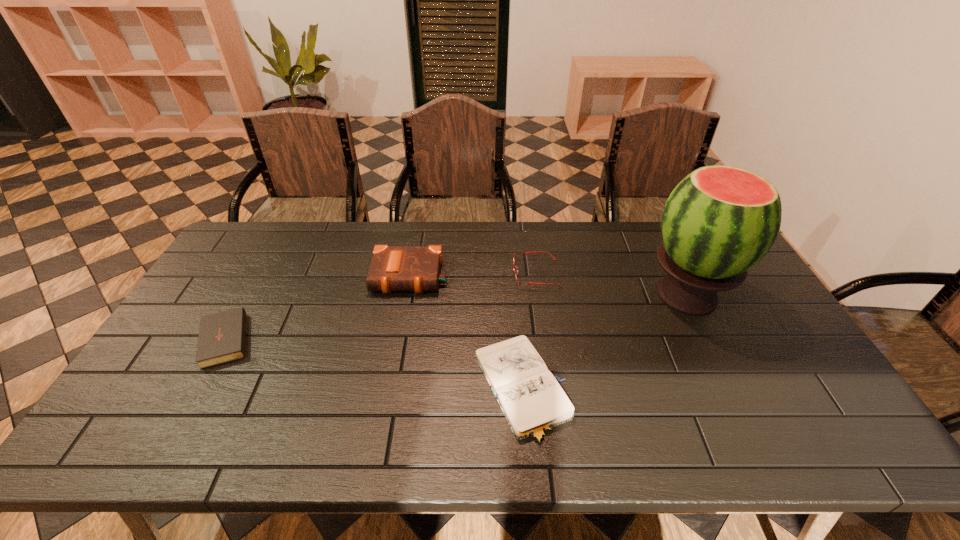
I want to click on vacant point located between the left Bible and the tallest object, so click(457, 315).

Identify the location of free area in between the spectacles and the shorter Bible. (382, 305).

Locate an element on the screen. This screenshot has width=960, height=540. vacant space that is in between the fourth object from right to left and the spectacles is located at coordinates (473, 275).

You are a GUI agent. You are given a task and a screenshot of the screen. Output one action in this format:
    pyautogui.click(x=<x>, y=<y>)
    Task: Click on the empty location between the rightmost object and the left Bible
    The width and height of the screenshot is (960, 540).
    Given the screenshot: What is the action you would take?
    pyautogui.click(x=457, y=315)

Find the location of a particular element. This screenshot has height=540, width=960. object that is the second nearest to the spectacles is located at coordinates (393, 268).

The width and height of the screenshot is (960, 540). I want to click on object that is the second closest to the right Bible, so click(521, 253).

The image size is (960, 540). I want to click on vacant position in the image that satisfies the following two spatial constraints: 1. on the spine side of the farther Bible; 2. on the left side of the rightmost object, so click(407, 295).

I want to click on free spot that satisfies the following two spatial constraints: 1. on the lenses of the spectacles; 2. on the right side of the watermelon, so click(539, 295).

Where is `vacant space that satisfies the following two spatial constraints: 1. on the back side of the tallest object; 2. on the lenses of the spectacles`? The height and width of the screenshot is (540, 960). vacant space that satisfies the following two spatial constraints: 1. on the back side of the tallest object; 2. on the lenses of the spectacles is located at coordinates (676, 273).

Identify the location of vacant region that satisfies the following two spatial constraints: 1. on the spine side of the taller Bible; 2. on the right side of the notebook. This screenshot has height=540, width=960. (391, 389).